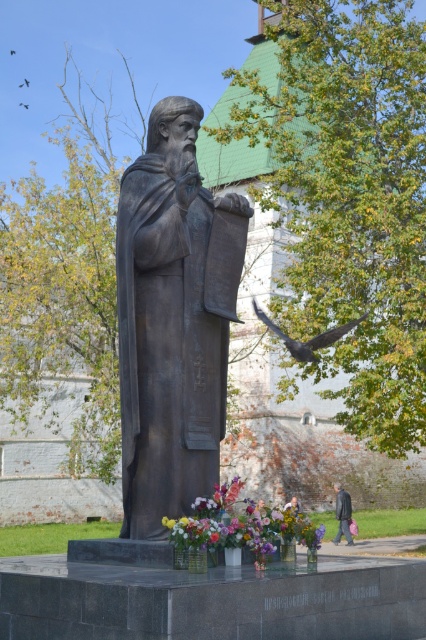
You are standing in front of the bronze statue and want to take a photo. You notice two points marked on the statue. Which point is closer to your camera? The points are labeled as point 1 at coordinate (264,522) and point 2 at coordinate (344,508).

Point 1 at coordinate (264,522) is closer to the camera than point 2 at coordinate (344,508).

Based on the photo, you are a visitor at the site and want to take a photo of both the bronze statue at center and the vibrant floral bouquet at center. Since you want to include both in the frame, will you need to zoom out your camera?

The bronze statue at center is narrower than the vibrant floral bouquet at center. To include both in the frame, you should zoom out your camera to accommodate the wider width of the vibrant floral bouquet at center.